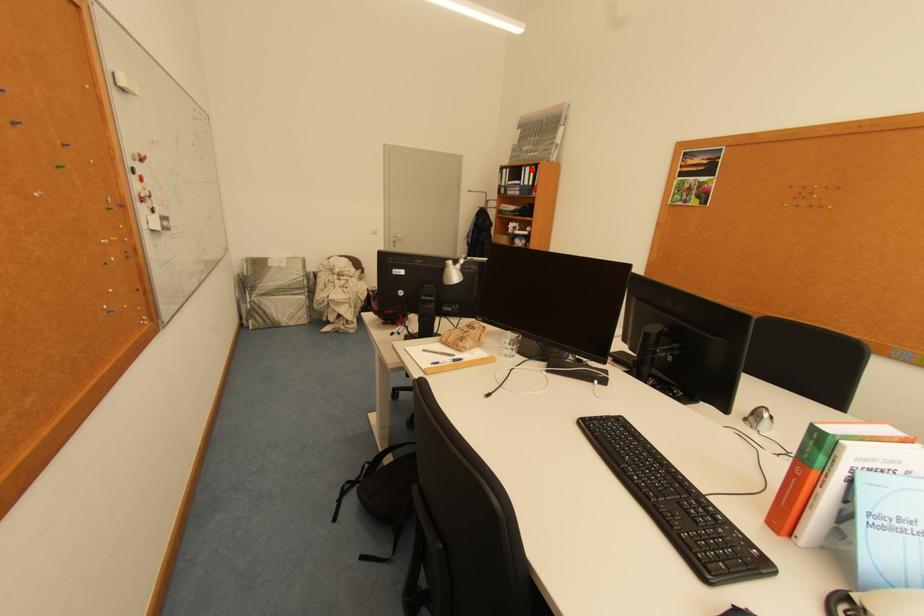
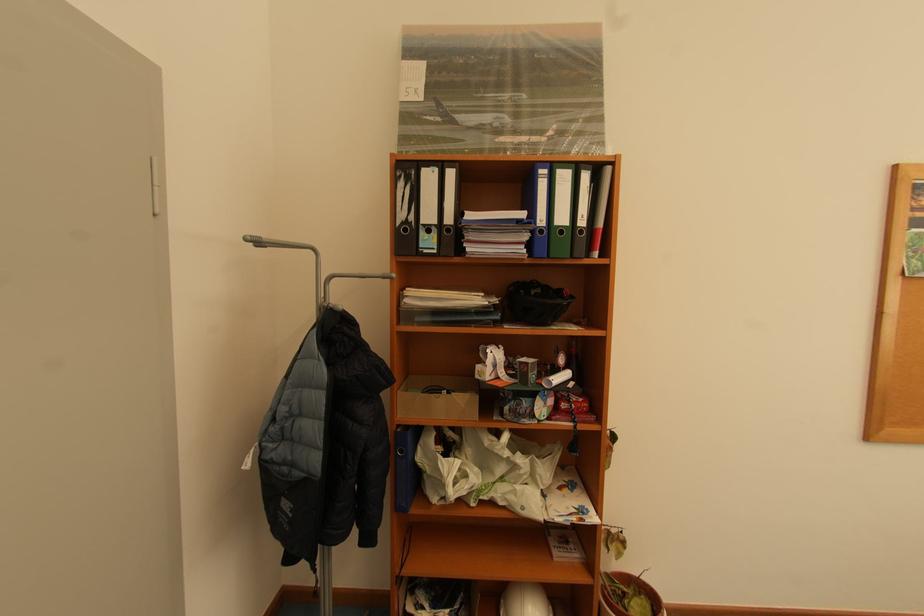
The point at the highlighted location is marked in the first image. Where is the corresponding point in the second image?

(552, 172)